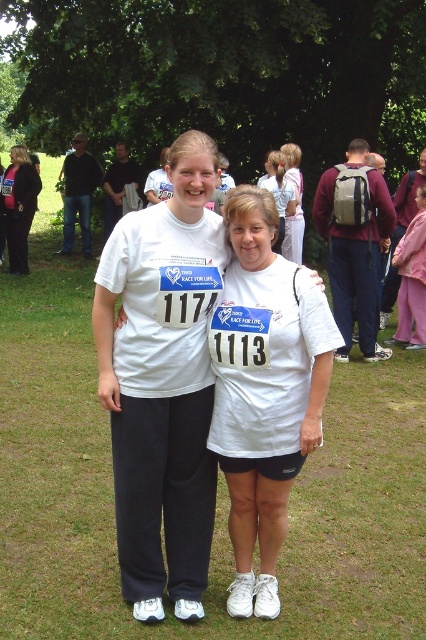
At what (x,y) coordinates should I click in order to perform the action: click on pink fabric coat at right. Please return your answer as a coordinate pair (x, y). The width and height of the screenshot is (426, 640). Looking at the image, I should click on (411, 280).

Between pink fabric coat at right and black fabric pants at left, which one appears on the right side from the viewer's perspective?

From the viewer's perspective, pink fabric coat at right appears more on the right side.

Does point (420, 340) come in front of point (14, 198)?

Yes, point (420, 340) is closer to viewer.

Locate an element on the screen. This screenshot has width=426, height=640. pink fabric coat at right is located at coordinates (411, 280).